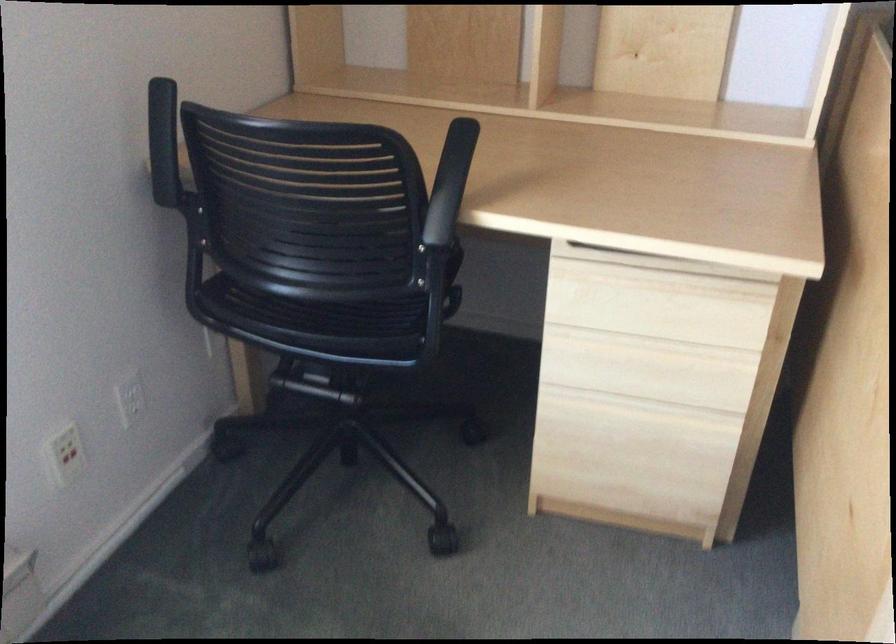
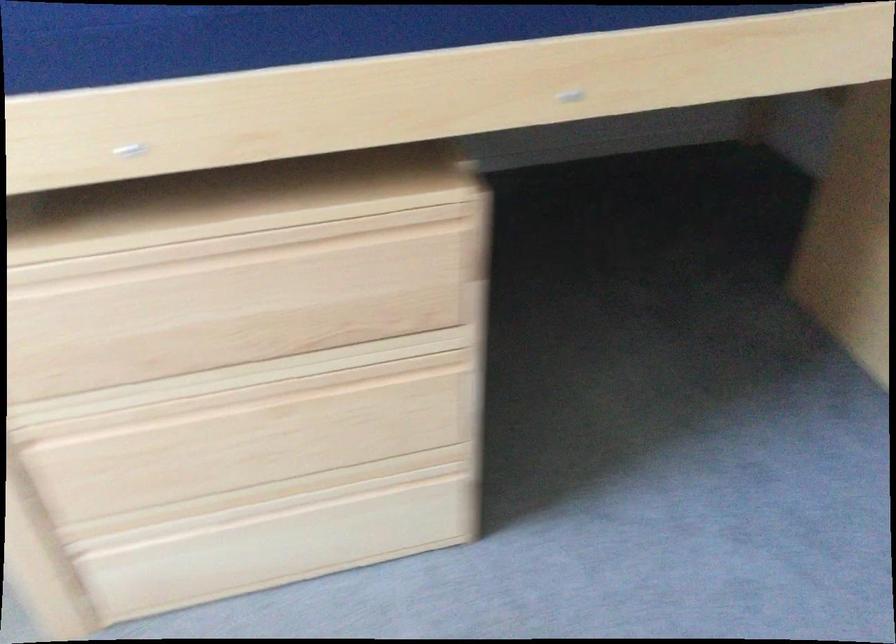
Question: The first image is from the beginning of the video and the second image is from the end. How did the camera likely rotate when shooting the video?

Choices:
 (A) Left
 (B) Right
 (C) Up
 (D) Down

Answer: (B)